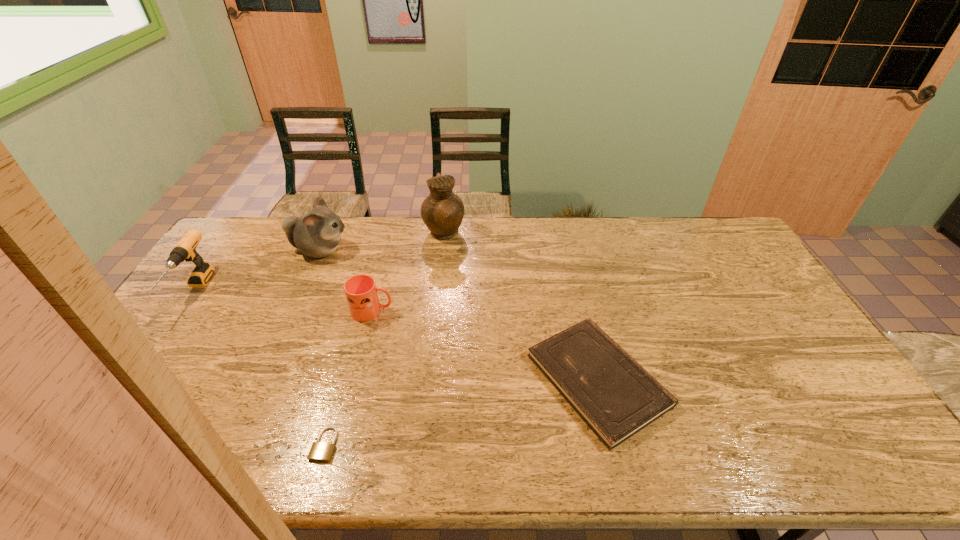
The width and height of the screenshot is (960, 540). I want to click on object located at the left edge, so click(x=185, y=249).

This screenshot has height=540, width=960. What are the coordinates of `vacant space at the far edge of the desktop` in the screenshot? It's located at (655, 254).

Find the location of a particular element. Image resolution: width=960 pixels, height=540 pixels. blank space at the near edge is located at coordinates (525, 438).

In the image, there is a desktop. Where is `free space at the left edge`? Image resolution: width=960 pixels, height=540 pixels. free space at the left edge is located at coordinates (239, 260).

Identify the location of free space at the right edge of the desktop. (821, 385).

This screenshot has height=540, width=960. I want to click on vacant space at the far left corner of the desktop, so click(x=232, y=237).

You are a GUI agent. You are given a task and a screenshot of the screen. Output one action in this format:
    pyautogui.click(x=<x>, y=<y>)
    Task: Click on the empty space that is in between the hamster and the drill
    The image size is (960, 540).
    Given the screenshot: What is the action you would take?
    pyautogui.click(x=257, y=271)

The image size is (960, 540). What are the coordinates of `empty space that is in between the rightmost object and the padlock` in the screenshot? It's located at (461, 412).

The height and width of the screenshot is (540, 960). I want to click on vacant area that lies between the padlock and the second object from left to right, so click(x=323, y=347).

The height and width of the screenshot is (540, 960). I want to click on vacant area that lies between the mug and the fifth tallest object, so click(x=485, y=346).